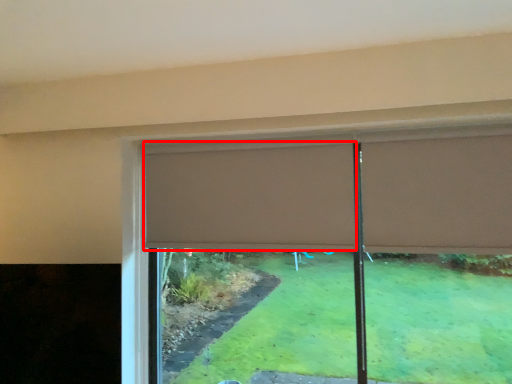
Question: From the image's perspective, considering the relative positions of curtain (annotated by the red box) and curtain in the image provided, where is curtain (annotated by the red box) located with respect to the staircase?

Choices:
 (A) above
 (B) below

Answer: (B)